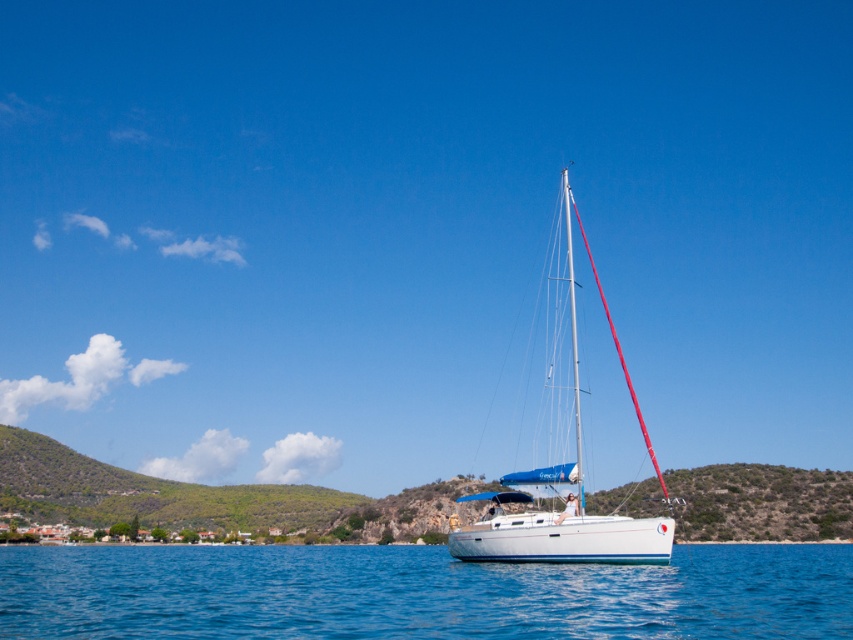
You are a photographer planning to capture the white glossy sailboat at center and the blue water at center in a single shot. Based on their positions, which object should you focus on first to ensure both are in frame?

The blue water at center is to the left of the white glossy sailboat at center, so you should focus on the white glossy sailboat at center first to ensure both are in frame.

You are standing on the deck of the sailboat and want to reach both the point at coordinates point [109,627] and the point at coordinates point [614,518]. Which point is closer to you?

Point [109,627] is closer to the viewer than point [614,518], so you will reach point [109,627] first.